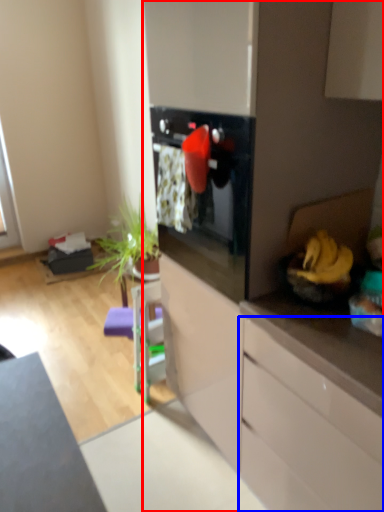
Question: Which object is closer to the camera taking this photo, dresser (highlighted by a red box) or cabinetry (highlighted by a blue box)?

Choices:
 (A) dresser
 (B) cabinetry

Answer: (B)